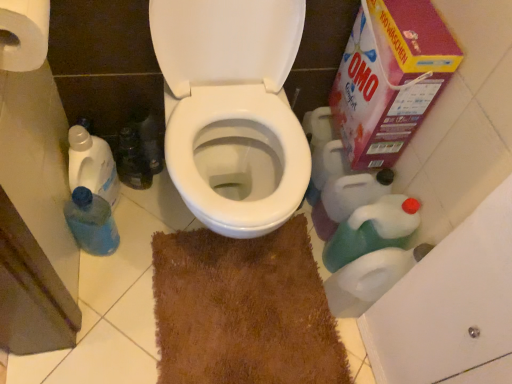
Question: Is cardboard box at upper right taller than blue plastic bottle at left, the first cleaning product from the left?

Choices:
 (A) yes
 (B) no

Answer: (A)

Question: From a real-world perspective, is cardboard box at upper right located higher than blue plastic bottle at left, the 2th cleaning product from the right?

Choices:
 (A) yes
 (B) no

Answer: (A)

Question: Is blue plastic bottle at left, the 2th cleaning product from the right, completely or partially inside cardboard box at upper right?

Choices:
 (A) yes
 (B) no

Answer: (B)

Question: Considering the relative positions of cardboard box at upper right and blue plastic bottle at left, the 2th cleaning product from the right, in the image provided, is cardboard box at upper right to the left of blue plastic bottle at left, the 2th cleaning product from the right, from the viewer's perspective?

Choices:
 (A) no
 (B) yes

Answer: (A)

Question: From the image's perspective, is cardboard box at upper right beneath blue plastic bottle at left, the first cleaning product from the left?

Choices:
 (A) yes
 (B) no

Answer: (B)

Question: Visually, is brown shaggy rug at center positioned to the left or to the right of white paper towel at upper left?

Choices:
 (A) right
 (B) left

Answer: (A)

Question: From the image's perspective, relative to white paper towel at upper left, is brown shaggy rug at center above or below?

Choices:
 (A) below
 (B) above

Answer: (A)

Question: Is brown shaggy rug at center taller or shorter than white paper towel at upper left?

Choices:
 (A) short
 (B) tall

Answer: (A)

Question: In the image, is brown shaggy rug at center positioned in front of or behind white paper towel at upper left?

Choices:
 (A) front
 (B) behind

Answer: (B)

Question: From their relative heights in the image, would you say green plastic bottle at lower right, which ranks as the second cleaning product in left-to-right order, is taller or shorter than blue translucent bottle at lower left?

Choices:
 (A) tall
 (B) short

Answer: (A)

Question: From the image's perspective, relative to blue translucent bottle at lower left, is green plastic bottle at lower right, which ranks as the second cleaning product in left-to-right order, above or below?

Choices:
 (A) above
 (B) below

Answer: (B)

Question: Looking at their shapes, would you say green plastic bottle at lower right, which ranks as the first cleaning product in right-to-left order, is wider or thinner than blue translucent bottle at lower left?

Choices:
 (A) thin
 (B) wide

Answer: (B)

Question: Is green plastic bottle at lower right, which ranks as the first cleaning product in right-to-left order, inside or outside of blue translucent bottle at lower left?

Choices:
 (A) outside
 (B) inside

Answer: (A)

Question: Considering the positions of point 395,64 and point 197,289, is point 395,64 closer or farther from the camera than point 197,289?

Choices:
 (A) farther
 (B) closer

Answer: (B)

Question: In terms of size, does cardboard box at upper right appear bigger or smaller than brown shaggy rug at center?

Choices:
 (A) big
 (B) small

Answer: (A)